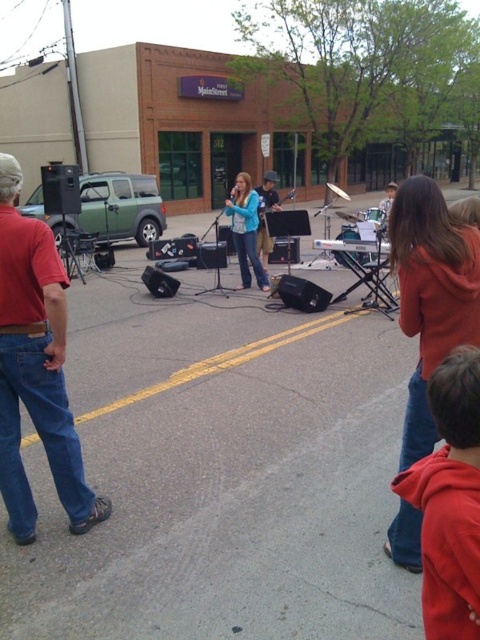
Who is positioned more to the right, matte red shirt at left or blue denim jeans at center?

From the viewer's perspective, blue denim jeans at center appears more on the right side.

Does matte red shirt at left lie in front of blue denim jeans at center?

Yes, it is in front of blue denim jeans at center.

Which is behind, point (61, 444) or point (263, 227)?

Positioned behind is point (263, 227).

Identify the location of matte red shirt at left. (36, 368).

Can you confirm if orange hoodie at right is wider than blue denim jacket at center?

No, orange hoodie at right is not wider than blue denim jacket at center.

The height and width of the screenshot is (640, 480). What do you see at coordinates (431, 296) in the screenshot? I see `orange hoodie at right` at bounding box center [431, 296].

Where is `orange hoodie at right`? orange hoodie at right is located at coordinates (431, 296).

Identify the location of blue denim jacket at center. Image resolution: width=480 pixels, height=640 pixels. (245, 228).

Is blue denim jacket at center shorter than blue denim jeans at center?

No.

The width and height of the screenshot is (480, 640). What do you see at coordinates (245, 228) in the screenshot? I see `blue denim jacket at center` at bounding box center [245, 228].

The height and width of the screenshot is (640, 480). In order to click on blue denim jacket at center in this screenshot , I will do `click(245, 228)`.